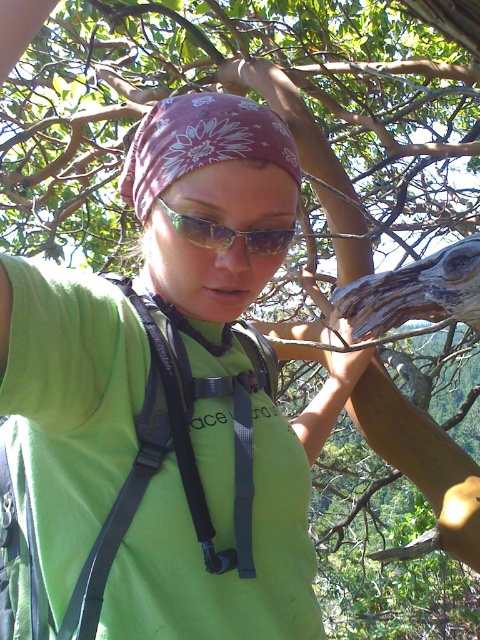
Between purple floral bandana at center and green plastic goggles at center, which one has more height?

purple floral bandana at center

Is point (251, 132) closer to viewer compared to point (204, 244)?

Yes, it is.

Does point (229, 106) come behind point (264, 237)?

Yes.

You are a GUI agent. You are given a task and a screenshot of the screen. Output one action in this format:
    pyautogui.click(x=<x>, y=<y>)
    Task: Click on the purple floral bandana at center
    Image resolution: width=480 pixels, height=640 pixels.
    Given the screenshot: What is the action you would take?
    pyautogui.click(x=200, y=141)

Looking at this image, who is more distant from viewer, (139,298) or (200,163)?

Positioned behind is point (139,298).

Is black fabric strap at center thinner than purple floral bandana at center?

No.

In order to click on black fabric strap at center in this screenshot , I will do `click(177, 456)`.

Can you confirm if black fabric strap at center is positioned above green plastic goggles at center?

Actually, black fabric strap at center is below green plastic goggles at center.

Based on the photo, is black fabric strap at center thinner than green plastic goggles at center?

In fact, black fabric strap at center might be wider than green plastic goggles at center.

Based on the photo, who is more forward, (192, 378) or (277, 234)?

Point (277, 234)

This screenshot has height=640, width=480. Identify the location of black fabric strap at center. (177, 456).